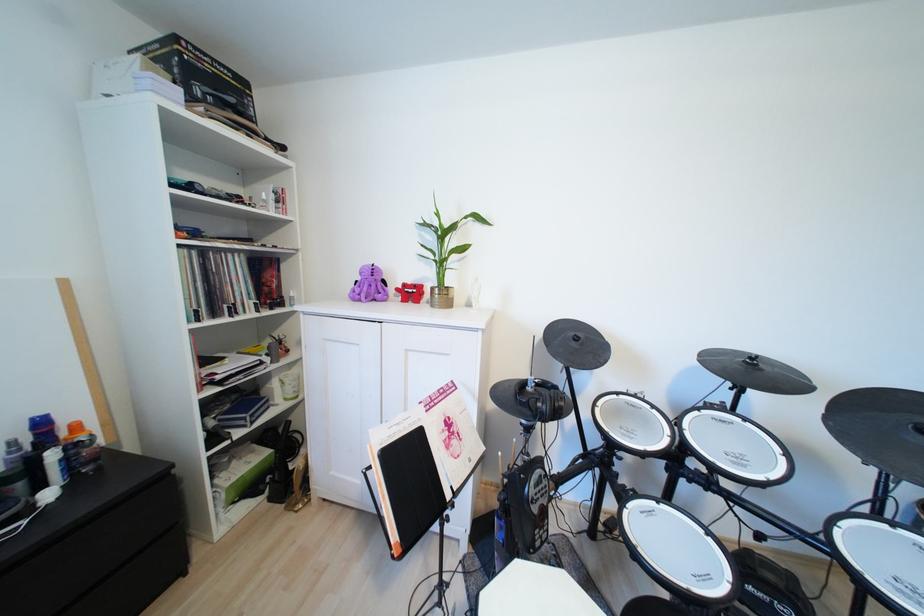
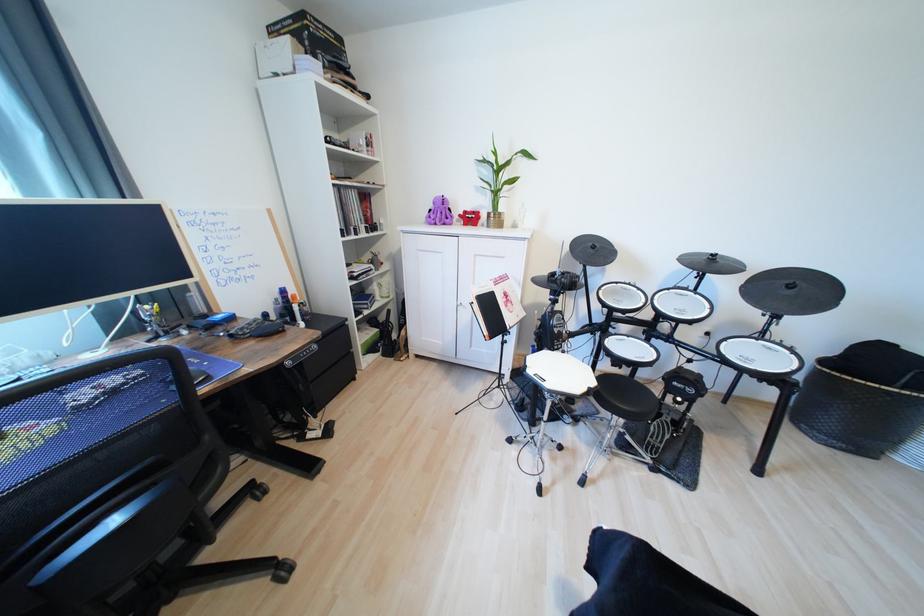
Question: The images are taken continuously from a first-person perspective. In which direction is your viewpoint rotating?

Choices:
 (A) Left
 (B) Right
 (C) Up
 (D) Down

Answer: (D)